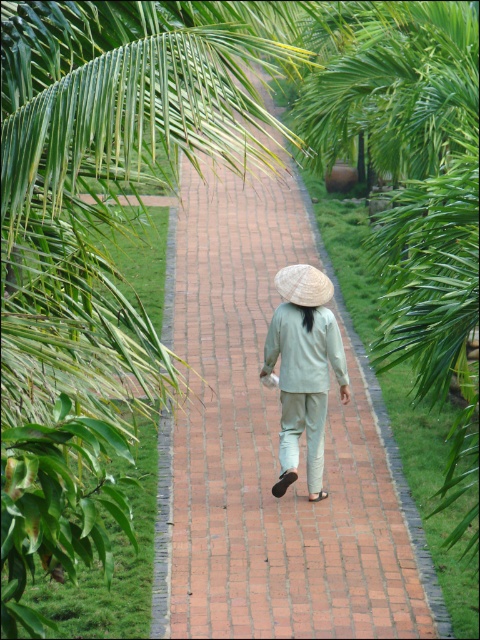
Question: Among these objects, which one is nearest to the camera?

Choices:
 (A) white straw hat at center
 (B) brick pavement at center
 (C) light green fabric at center

Answer: (B)

Question: Which is nearer to the brick pavement at center?

Choices:
 (A) light green fabric at center
 (B) white straw hat at center

Answer: (A)

Question: Is brick pavement at center wider than white straw hat at center?

Choices:
 (A) yes
 (B) no

Answer: (A)

Question: Which object is positioned closest to the white straw hat at center?

Choices:
 (A) light green fabric at center
 (B) brick pavement at center

Answer: (A)

Question: Is brick pavement at center positioned in front of white straw hat at center?

Choices:
 (A) yes
 (B) no

Answer: (A)

Question: Is brick pavement at center further to camera compared to white straw hat at center?

Choices:
 (A) no
 (B) yes

Answer: (A)